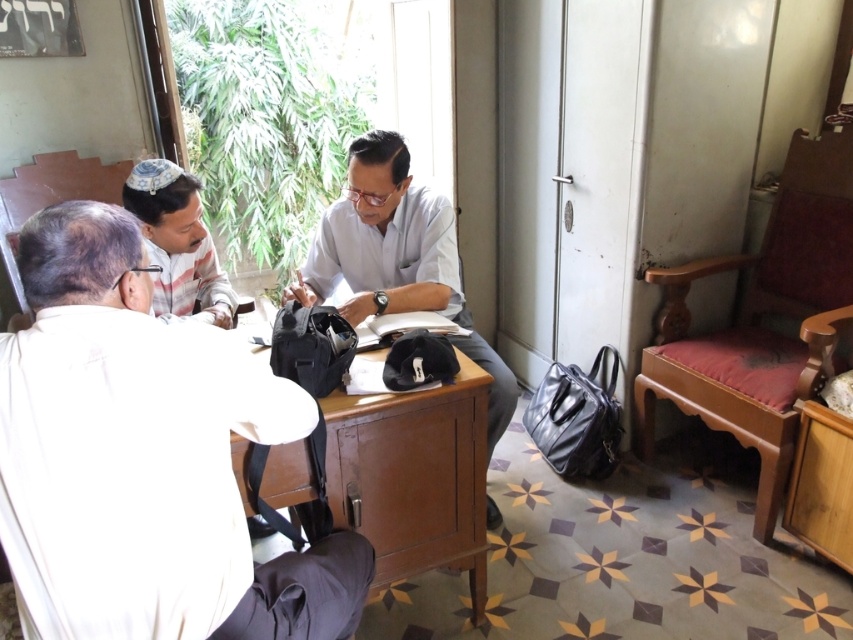
Which of these two, white matte shirt at left or white cloth at upper left, stands shorter?

white cloth at upper left is shorter.

Is point (207, 556) positioned in front of point (171, 248)?

Yes, it is in front of point (171, 248).

The image size is (853, 640). What are the coordinates of `white matte shirt at left` in the screenshot? It's located at (144, 458).

Who is more forward, (3, 390) or (378, 508)?

Point (3, 390) is in front.

The height and width of the screenshot is (640, 853). I want to click on white matte shirt at left, so click(x=144, y=458).

At what (x,y) coordinates should I click in order to perform the action: click on white matte shirt at center. Please return your answer as a coordinate pair (x, y). Image resolution: width=853 pixels, height=640 pixels. Looking at the image, I should click on (384, 241).

In the scene shown: Who is higher up, white matte shirt at center or white cloth at upper left?

white cloth at upper left is above.

Who is more forward, (494, 508) or (141, 161)?

Point (141, 161)

Where is `white matte shirt at center`? The width and height of the screenshot is (853, 640). white matte shirt at center is located at coordinates (384, 241).